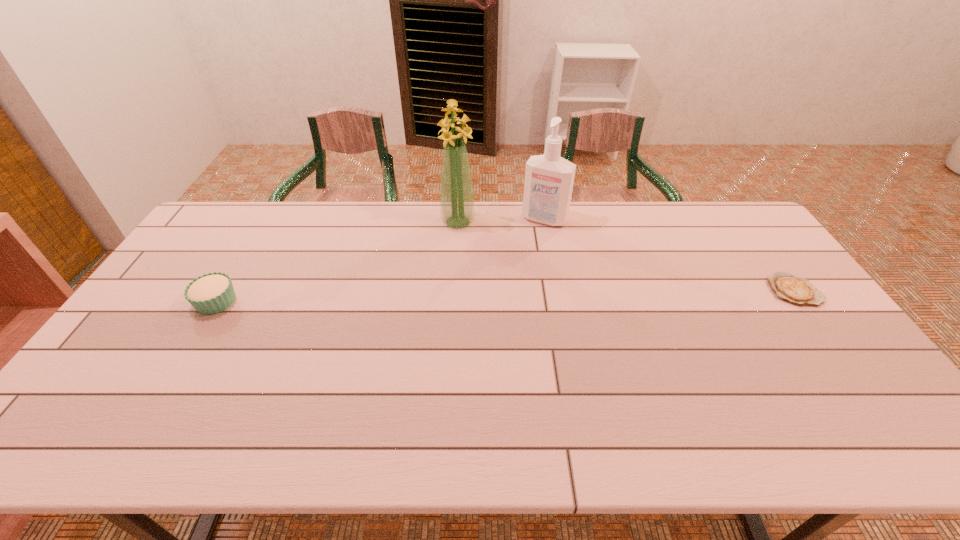
You are a GUI agent. You are given a task and a screenshot of the screen. Output one action in this format:
    pyautogui.click(x=<x>, y=<y>)
    Task: Click on the cupcake
    
    Given the screenshot: What is the action you would take?
    pyautogui.click(x=211, y=293)

Locate an element on the screen. The width and height of the screenshot is (960, 540). the third tallest object is located at coordinates (211, 293).

Find the location of `the rightmost object`. the rightmost object is located at coordinates (800, 291).

You are a GUI agent. You are given a task and a screenshot of the screen. Output one action in this format:
    pyautogui.click(x=<x>, y=<y>)
    Task: Click on the quiche
    The image size is (960, 540).
    Given the screenshot: What is the action you would take?
    pyautogui.click(x=800, y=291)

Locate an element on the screen. The image size is (960, 540). cleansing agent is located at coordinates pos(549,178).

Locate an element on the screen. the second object from right to left is located at coordinates (549, 178).

Identify the location of the second object from left to right. (457, 203).

You are a GUI agent. You are given a task and a screenshot of the screen. Output one action in this format:
    pyautogui.click(x=<x>, y=<y>)
    Task: Click on the free space located 0.230m on the right of the leftmost object
    The height and width of the screenshot is (540, 960).
    Given the screenshot: What is the action you would take?
    pyautogui.click(x=315, y=302)

Identify the location of vacant space located on the back of the quiche. (774, 262).

Locate an element on the screen. This screenshot has height=540, width=960. free location located on the front label of the second object from right to left is located at coordinates (522, 255).